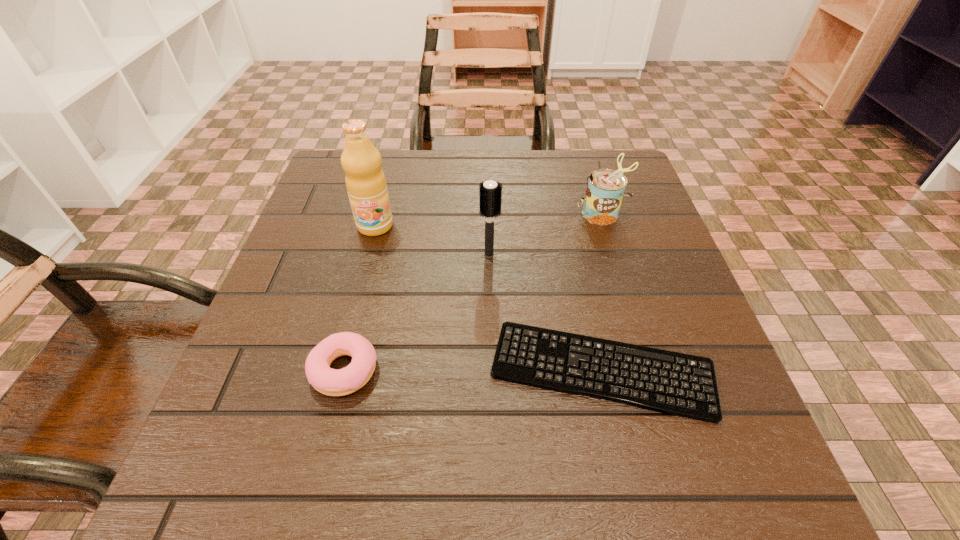
Where is `free space located on the left of the shortest object`? This screenshot has height=540, width=960. free space located on the left of the shortest object is located at coordinates (341, 370).

Locate an element on the screen. object positioned at the far edge is located at coordinates (605, 190).

Image resolution: width=960 pixels, height=540 pixels. Identify the location of fruit juice that is at the left edge. (366, 185).

What are the coordinates of `doughnut positioned at the left edge` in the screenshot? It's located at (328, 381).

Where is `can that is at the right edge`? The image size is (960, 540). can that is at the right edge is located at coordinates (605, 190).

This screenshot has height=540, width=960. Identify the location of computer keyboard that is positioned at the right edge. (674, 383).

Locate an element on the screen. The image size is (960, 540). object that is at the far right corner is located at coordinates (605, 190).

This screenshot has width=960, height=540. In the image, there is a desktop. What are the coordinates of `vacant space at the far edge` in the screenshot? It's located at (516, 159).

Identify the location of free space at the near edge of the desktop. This screenshot has width=960, height=540. (415, 505).

At what (x,y) coordinates should I click in order to perform the action: click on vacant space at the left edge of the desktop. Please return your answer as a coordinate pair (x, y). The height and width of the screenshot is (540, 960). Looking at the image, I should click on (314, 227).